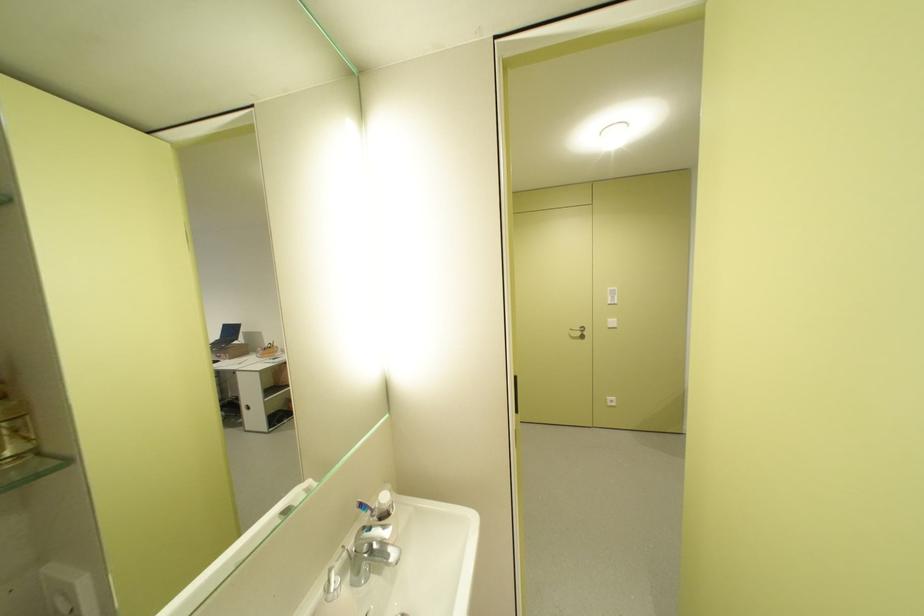
This screenshot has height=616, width=924. I want to click on chrome faucet handle, so click(371, 552).